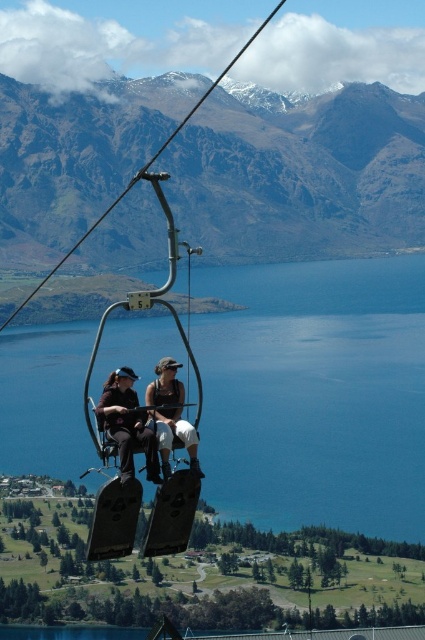
Between blue water at center and matte black jacket at center, which one is positioned higher?

blue water at center is higher up.

Is blue water at center below matte black jacket at center?

Incorrect, blue water at center is not positioned below matte black jacket at center.

Which is behind, point (266, 317) or point (153, 380)?

Positioned behind is point (266, 317).

Locate an element on the screen. This screenshot has width=425, height=640. blue water at center is located at coordinates (316, 394).

In the scene shown: Which is below, rugged brown mountain at upper center or metallic gray ski lift at center?

metallic gray ski lift at center

Can you confirm if rugged brown mountain at upper center is positioned to the right of metallic gray ski lift at center?

Yes, rugged brown mountain at upper center is to the right of metallic gray ski lift at center.

Between point (198, 218) and point (90, 548), which one is positioned in front?

Positioned in front is point (90, 548).

Find the location of a particular element. rugged brown mountain at upper center is located at coordinates (300, 173).

Between metallic gray ski lift seat at center and matte black seat at center, which one appears on the left side from the viewer's perspective?

matte black seat at center

Is metallic gray ski lift seat at center positioned in front of matte black seat at center?

Yes, metallic gray ski lift seat at center is in front of matte black seat at center.

Describe the element at coordinates (172, 515) in the screenshot. I see `metallic gray ski lift seat at center` at that location.

Where is `metallic gray ski lift seat at center`? metallic gray ski lift seat at center is located at coordinates (172, 515).